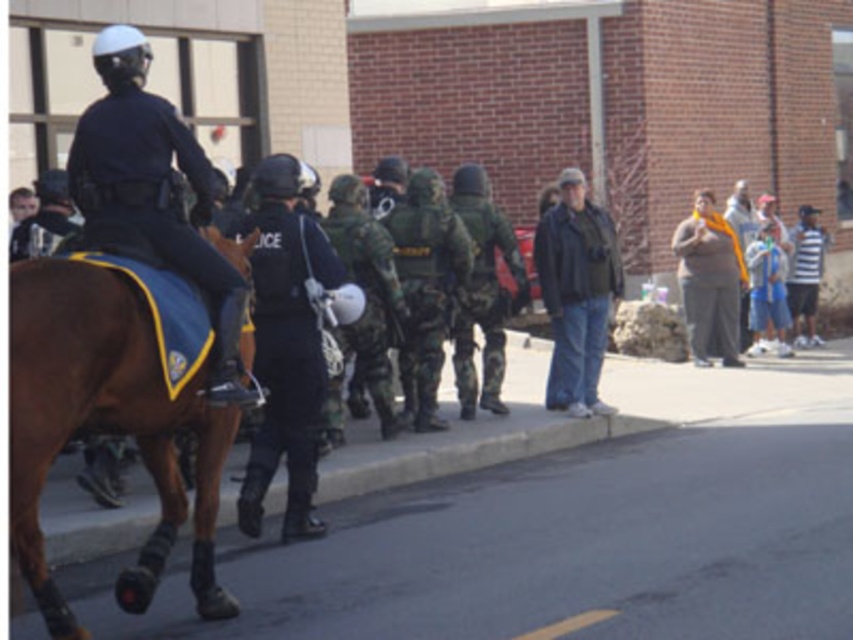
Question: Which object is farther from the camera taking this photo?

Choices:
 (A) dark blue uniform at left
 (B) dark blue uniform at center

Answer: (B)

Question: Does dark blue uniform at left appear under dark blue uniform at center?

Choices:
 (A) yes
 (B) no

Answer: (B)

Question: From the image, what is the correct spatial relationship of brown leather saddle at left in relation to dark blue uniform at center?

Choices:
 (A) right
 (B) left

Answer: (B)

Question: Which of these objects is positioned farthest from the brown leather saddle at left?

Choices:
 (A) dark blue uniform at center
 (B) dark blue uniform at left

Answer: (A)

Question: Which object is positioned closest to the dark blue uniform at center?

Choices:
 (A) dark blue uniform at left
 (B) brown leather saddle at left

Answer: (A)

Question: Does brown leather saddle at left have a smaller size compared to dark blue uniform at center?

Choices:
 (A) yes
 (B) no

Answer: (B)